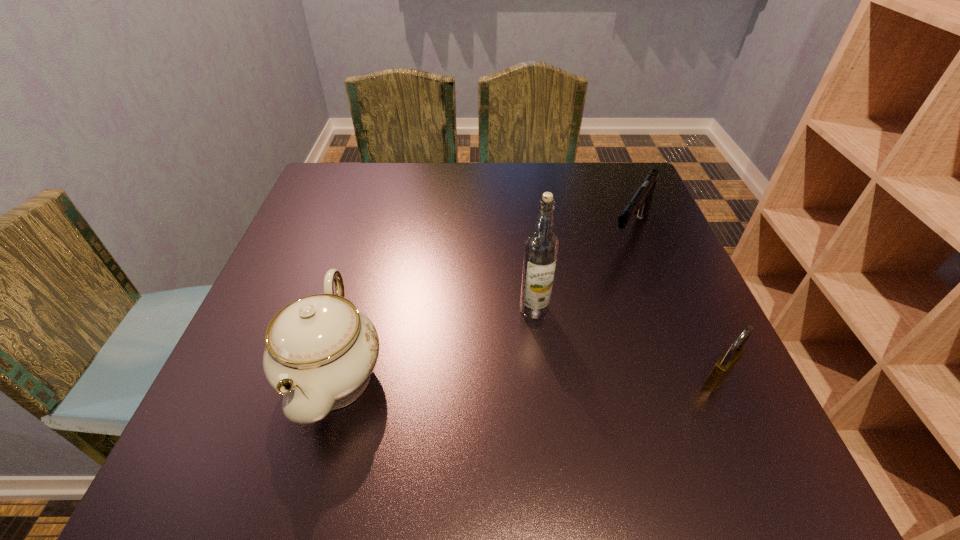
This screenshot has width=960, height=540. In order to click on free space between the second object from left to right and the farthest object in this screenshot , I will do `click(582, 271)`.

This screenshot has width=960, height=540. In order to click on free spot between the tallest object and the leftmost object in this screenshot , I will do `click(434, 342)`.

I want to click on empty space between the padlock and the tallest object, so click(625, 345).

This screenshot has width=960, height=540. Identify the location of free space that is in between the padlock and the farthest object. pyautogui.click(x=673, y=306).

Locate an element on the screen. unoccupied area between the padlock and the leftmost object is located at coordinates (525, 377).

Identify the location of empty location between the second tallest object and the vodka. (434, 342).

Where is `free space between the leftmost object and the gun`? This screenshot has width=960, height=540. free space between the leftmost object and the gun is located at coordinates (482, 303).

The image size is (960, 540). Find the location of `free space between the vodka and the padlock`. free space between the vodka and the padlock is located at coordinates (625, 345).

Where is `empty space that is in between the chinaware and the padlock`? The height and width of the screenshot is (540, 960). empty space that is in between the chinaware and the padlock is located at coordinates (x=525, y=377).

Locate an element on the screen. The height and width of the screenshot is (540, 960). free area in between the second object from left to right and the chinaware is located at coordinates (434, 342).